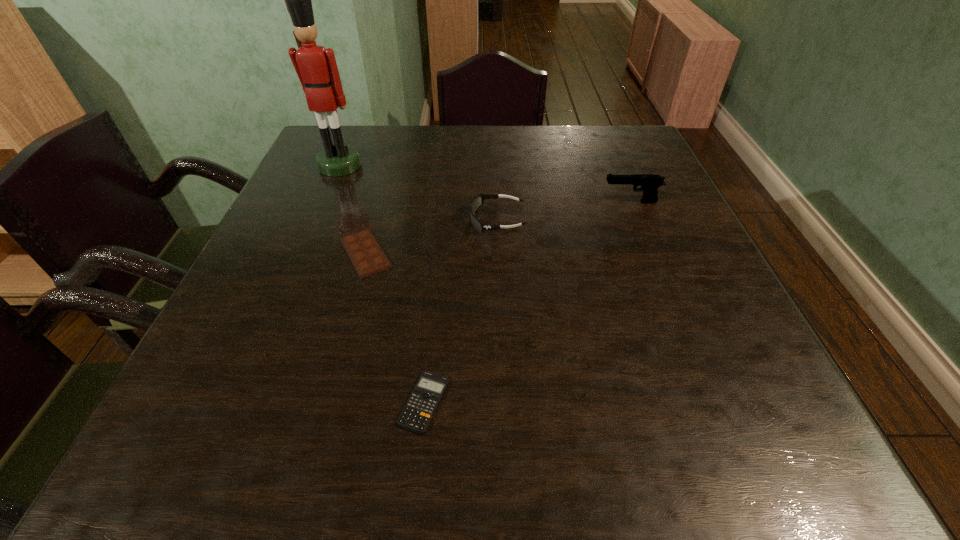
Find the location of a particular element. the farthest object is located at coordinates (316, 67).

Where is `nutcracker`? The image size is (960, 540). nutcracker is located at coordinates (316, 67).

At what (x,y) coordinates should I click in order to perform the action: click on pistol. Please return your answer as a coordinate pair (x, y). The image size is (960, 540). Looking at the image, I should click on (649, 183).

The height and width of the screenshot is (540, 960). I want to click on the second tallest object, so click(649, 183).

Locate an element on the screen. This screenshot has height=540, width=960. the third shortest object is located at coordinates (476, 202).

At what (x,y) coordinates should I click in order to perform the action: click on goggles. Please return your answer as a coordinate pair (x, y). The height and width of the screenshot is (540, 960). Looking at the image, I should click on (476, 202).

In order to click on the fourth object from right to left in this screenshot , I will do `click(365, 253)`.

Locate an element on the screen. the fourth tallest object is located at coordinates (365, 253).

Locate an element on the screen. The image size is (960, 540). the shortest object is located at coordinates (418, 411).

This screenshot has height=540, width=960. What are the coordinates of `the nearest object` in the screenshot? It's located at (418, 411).